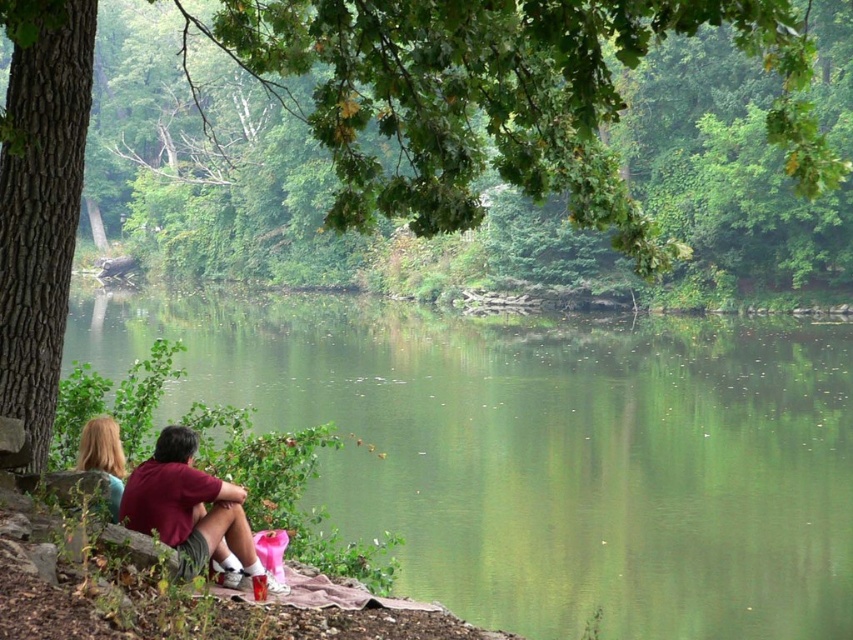
You are a photographer trying to capture a photo of the green smooth water at lower center and the blonde hair at left. Which object should you focus on first if you want to ensure both are in focus?

The green smooth water at lower center is taller than the blonde hair at left, so focusing on the taller object first would help ensure both are in focus.

You are a painter standing at the edge of the lake, wanting to set up your easel between the smooth brown tree trunk at left and the maroon cotton shirt at lower left. The easel requires at least 2 meters of space. Do you think there is enough space between them?

The distance between the smooth brown tree trunk at left and the maroon cotton shirt at lower left is 2.70 meters, which is more than the required 2 meters. Therefore, there is enough space to set up the easel between them.

You are standing at the point marked by the coordinates (544, 452) in the image. Looking around, you see a green smooth water at lower center. Which direction should you walk to reach the wooden bench where the two people are sitting?

The point marked by the coordinates (544, 452) is on the green smooth water at lower center. The wooden bench is positioned under the shade of a large tree trunk on the left side of the image. To reach the bench, you should walk towards the left direction from the point on the water.